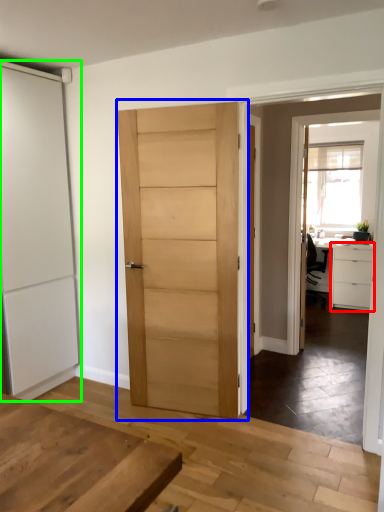
Question: Estimate the real-world distances between objects in this image. Which object is closer to cabinetry (highlighted by a red box), door (highlighted by a blue box) or door (highlighted by a green box)?

Choices:
 (A) door
 (B) door

Answer: (A)